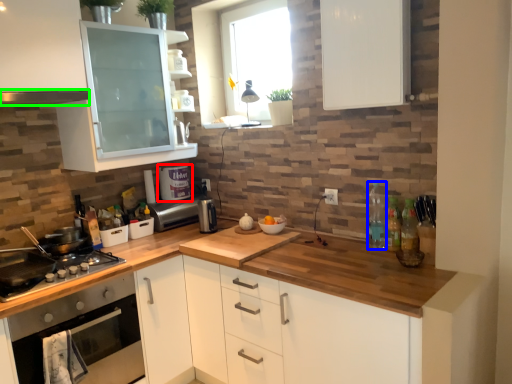
Question: Which is farther away from appliance (highlighted by a red box)? bottle (highlighted by a blue box) or exhaust hood (highlighted by a green box)?

Choices:
 (A) bottle
 (B) exhaust hood

Answer: (A)